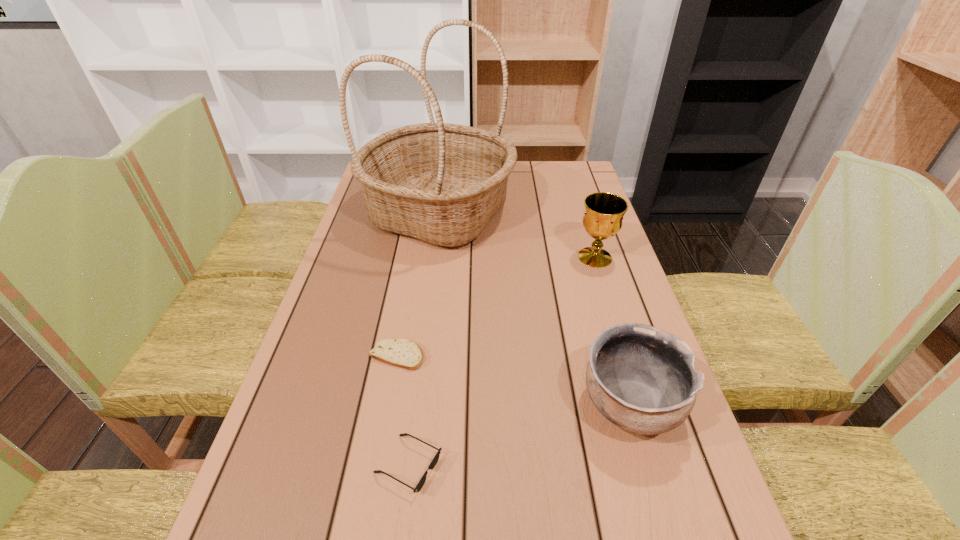
This screenshot has height=540, width=960. Identify the location of the tallest object. (441, 183).

Find the location of a particular element. The width and height of the screenshot is (960, 540). chalice is located at coordinates (603, 217).

I want to click on pottery, so click(641, 378).

Identify the location of the second shortest object. (433, 463).

You are a GUI agent. You are given a task and a screenshot of the screen. Output one action in this format:
    pyautogui.click(x=<x>, y=<y>)
    Task: Click on the pita bread
    
    Given the screenshot: What is the action you would take?
    pyautogui.click(x=403, y=353)

You are a GUI agent. You are given a task and a screenshot of the screen. Output one action in this format:
    pyautogui.click(x=<x>, y=<y>)
    Task: Click on the free space located 0.210m on the right of the tallest object
    Image resolution: width=960 pixels, height=540 pixels.
    Given the screenshot: What is the action you would take?
    pyautogui.click(x=580, y=213)

This screenshot has width=960, height=540. Identify the location of vacant area situated on the left of the second tallest object. (501, 257).

In order to click on vacant region located on the left of the pottery in this screenshot , I will do `click(516, 405)`.

Where is `vacant region located 0.060m on the lenses of the fourth tallest object`? The image size is (960, 540). vacant region located 0.060m on the lenses of the fourth tallest object is located at coordinates [x=475, y=465].

The height and width of the screenshot is (540, 960). Identify the location of vacant region located 0.340m on the back of the shortest object. (416, 251).